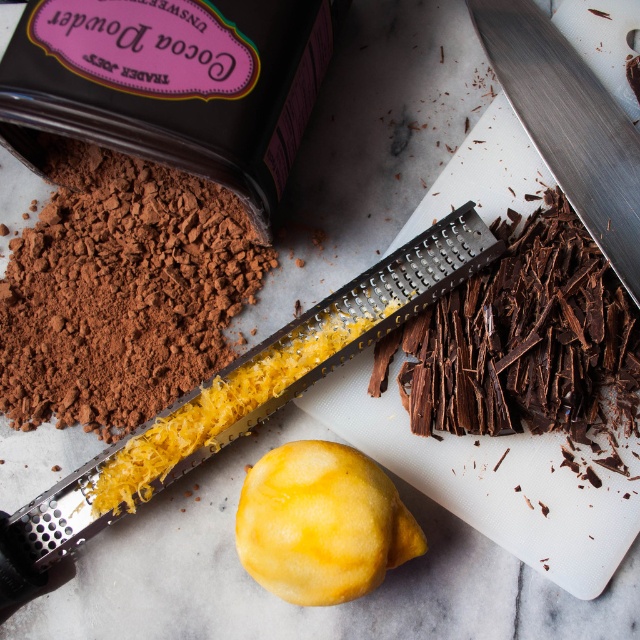
Question: Can you confirm if yellow matte lemon at center is positioned to the left of polished stainless steel knife at upper right?

Choices:
 (A) no
 (B) yes

Answer: (B)

Question: Can you confirm if yellow matte lemon at center is bigger than polished stainless steel knife at upper right?

Choices:
 (A) no
 (B) yes

Answer: (A)

Question: Which point is farther from the camera taking this photo?

Choices:
 (A) (634, 145)
 (B) (307, 563)

Answer: (A)

Question: Does yellow matte lemon at center appear over polished stainless steel knife at upper right?

Choices:
 (A) no
 (B) yes

Answer: (A)

Question: Among these objects, which one is farthest from the camera?

Choices:
 (A) polished stainless steel knife at upper right
 (B) yellow matte lemon at center

Answer: (A)

Question: Which object is farther from the camera taking this photo?

Choices:
 (A) yellow matte lemon at center
 (B) polished stainless steel knife at upper right

Answer: (B)